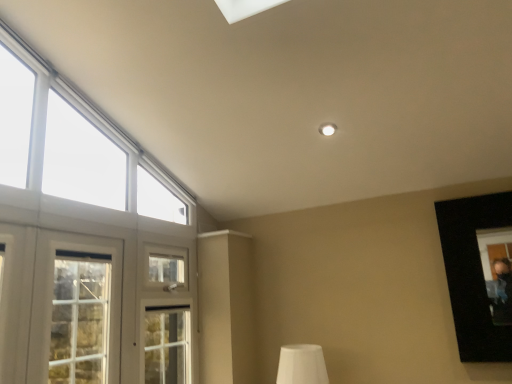
Question: In the image, is white glass window at upper left, the second window ordered from the bottom, on the left side or the right side of white matte table lamp at lower center?

Choices:
 (A) right
 (B) left

Answer: (B)

Question: Is white glass window at upper left, the first window positioned from the top, bigger or smaller than white matte table lamp at lower center?

Choices:
 (A) small
 (B) big

Answer: (B)

Question: Considering the real-world distances, which object is farthest from the white matte table lamp at lower center?

Choices:
 (A) white glass window at upper left, the first window positioned from the top
 (B) white wooden window at left, which ranks as the 1th window in bottom-to-top order

Answer: (B)

Question: Based on their relative distances, which object is farther from the white glass window at upper left, the second window ordered from the bottom?

Choices:
 (A) white wooden window at left, which ranks as the 1th window in bottom-to-top order
 (B) white matte table lamp at lower center

Answer: (A)